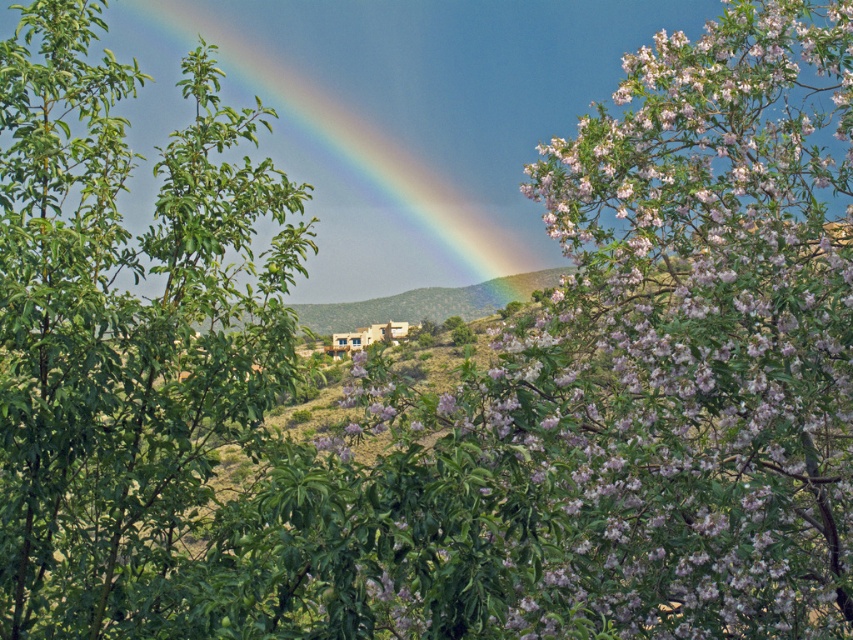
You are an artist trying to sketch the scene. You notice the green leafy tree at left and the rainbow at upper center. Which object has a narrower width?

The green leafy tree at left has a narrower width than the rainbow at upper center.

You are standing in the landscape and want to take a photo of the pink bloom at center and the rainbow at upper center. Which object should you focus on first if you want both to be in the same frame?

The pink bloom at center is located below rainbow at upper center, so you should focus on the pink bloom at center first to ensure both are in the same frame.